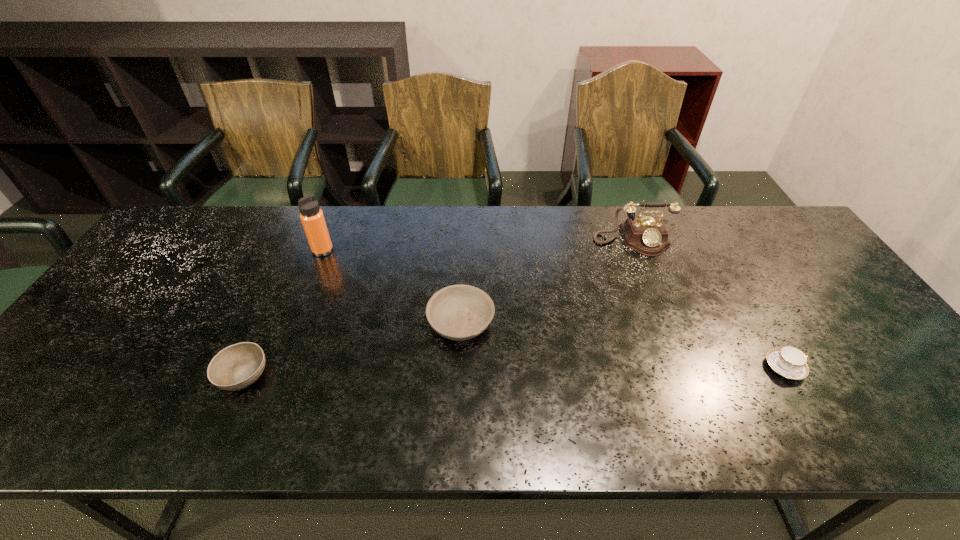
Where is `free space at the far right corner of the desktop`? The image size is (960, 540). free space at the far right corner of the desktop is located at coordinates (778, 247).

Where is `free space between the telephone and the tallest object`? The image size is (960, 540). free space between the telephone and the tallest object is located at coordinates (x=477, y=246).

The width and height of the screenshot is (960, 540). I want to click on vacant area that lies between the second object from right to left and the tallest object, so click(x=477, y=246).

Where is `free spot between the thermos bottle and the nearer bowl`? free spot between the thermos bottle and the nearer bowl is located at coordinates pos(283,313).

You are a GUI agent. You are given a task and a screenshot of the screen. Output one action in this format:
    pyautogui.click(x=<x>, y=<y>)
    Task: Click on the free point between the rightmost object and the nearer bowl
    
    Given the screenshot: What is the action you would take?
    pyautogui.click(x=514, y=371)

Find the location of `free space between the right bowl and the left bowl`. free space between the right bowl and the left bowl is located at coordinates pos(352,349).

Identify the location of vacant point located between the tallest object and the fourth object from left to right. The image size is (960, 540). (477, 246).

Where is `vacant area that lies between the fourth shortest object and the farther bowl`? vacant area that lies between the fourth shortest object and the farther bowl is located at coordinates (546, 282).

Where is `free area in between the thermos bottle and the left bowl`? This screenshot has width=960, height=540. free area in between the thermos bottle and the left bowl is located at coordinates (283, 313).

Locate an element on the screen. Image resolution: width=960 pixels, height=540 pixels. empty space that is in between the rightmost object and the thermos bottle is located at coordinates click(554, 309).